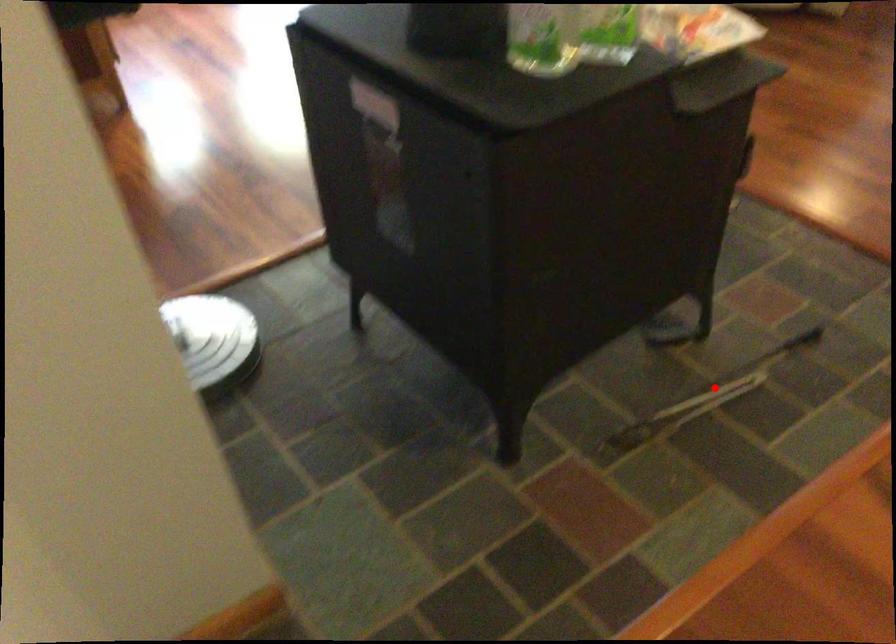
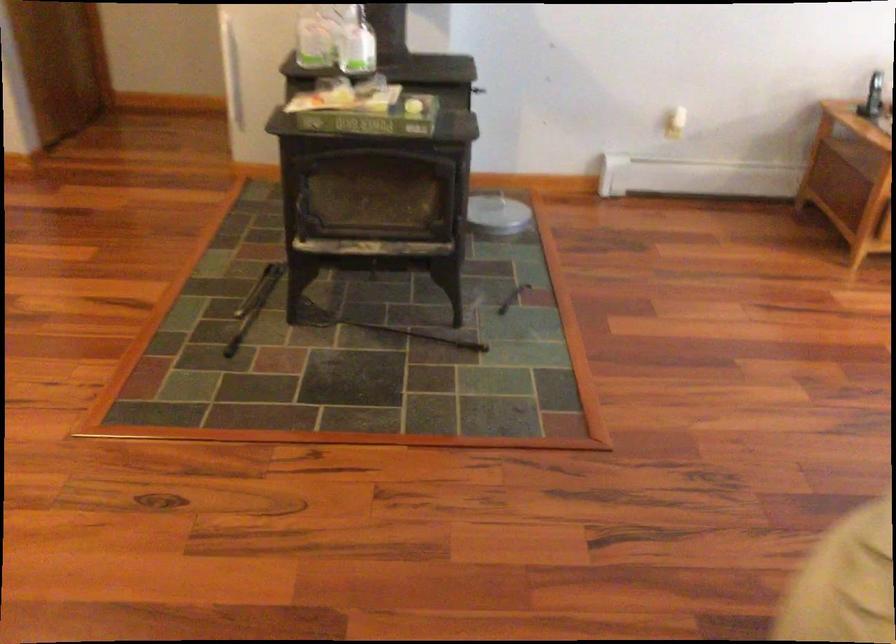
Locate, in the second image, the point that corresponds to the highlighted location in the first image.

(254, 305)